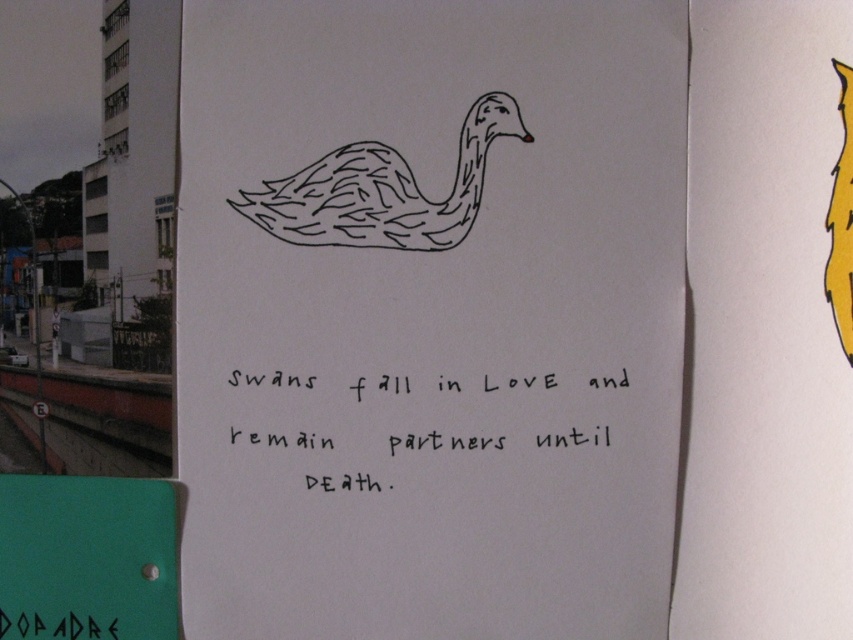
Question: Which object is closer to the camera taking this photo?

Choices:
 (A) black ink writing at center
 (B) black line drawing swan at center
 (C) yellow matte feather at upper right

Answer: (C)

Question: Is black ink writing at center thinner than yellow matte feather at upper right?

Choices:
 (A) yes
 (B) no

Answer: (B)

Question: Which object is the farthest from the black line drawing swan at center?

Choices:
 (A) yellow matte feather at upper right
 (B) black ink writing at center

Answer: (A)

Question: Which of the following is the farthest from the observer?

Choices:
 (A) yellow matte feather at upper right
 (B) black line drawing swan at center
 (C) black ink writing at center

Answer: (B)

Question: Does black ink writing at center appear on the left side of yellow matte feather at upper right?

Choices:
 (A) no
 (B) yes

Answer: (B)

Question: Is black line drawing swan at center to the left of black ink writing at center from the viewer's perspective?

Choices:
 (A) no
 (B) yes

Answer: (B)